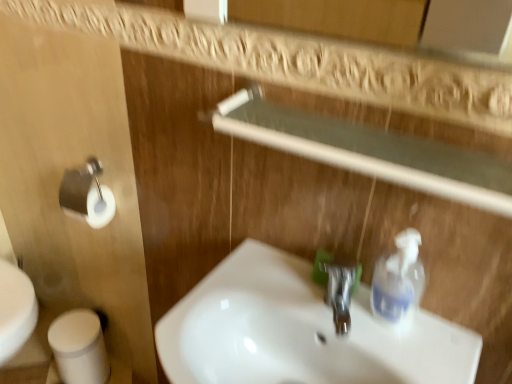
Describe the element at coordinates (300, 332) in the screenshot. I see `white glossy sink at center` at that location.

The width and height of the screenshot is (512, 384). What do you see at coordinates (398, 279) in the screenshot? I see `clear plastic soap dispenser at right` at bounding box center [398, 279].

Describe the element at coordinates (370, 151) in the screenshot. I see `transparent glass balustrade at upper center` at that location.

Where is `polished chrome faucet at center`? polished chrome faucet at center is located at coordinates (340, 292).

How different are the orientations of polished chrome faucet at center and white matte toilet paper at lower left in degrees?

88.8 degrees.

Is polished chrome faucet at center next to white matte toilet paper at lower left and touching it?

polished chrome faucet at center and white matte toilet paper at lower left are not in contact.

Which is behind, polished chrome faucet at center or white matte toilet paper at lower left?

white matte toilet paper at lower left is further from the camera.

Which is closer, (350, 284) or (84, 365)?

Clearly, point (350, 284) is closer to the camera than point (84, 365).

Is white matte toilet paper at lower left not near polished chrome faucet at center?

Yes, white matte toilet paper at lower left and polished chrome faucet at center are quite far apart.

Consider the image. Which of these two, white matte toilet paper at lower left or polished chrome faucet at center, stands shorter?

polished chrome faucet at center.

Is white matte toilet paper at lower left looking in the opposite direction of polished chrome faucet at center?

white matte toilet paper at lower left is not turned away from polished chrome faucet at center.

In the image, is transparent glass balustrade at upper center positioned in front of or behind clear plastic soap dispenser at right?

Clearly, transparent glass balustrade at upper center is in front of clear plastic soap dispenser at right.

From a real-world perspective, which is physically below, transparent glass balustrade at upper center or clear plastic soap dispenser at right?

clear plastic soap dispenser at right.

From the image's perspective, relative to clear plastic soap dispenser at right, is transparent glass balustrade at upper center above or below?

Based on their image positions, transparent glass balustrade at upper center is located above clear plastic soap dispenser at right.

Can you confirm if transparent glass balustrade at upper center is positioned to the left of white glossy sink at center?

No.

From a real-world perspective, which is physically above, transparent glass balustrade at upper center or white glossy sink at center?

transparent glass balustrade at upper center.

Which of these two, transparent glass balustrade at upper center or white glossy sink at center, is bigger?

white glossy sink at center is bigger.

Considering the relative positions of transparent glass balustrade at upper center and white glossy sink at center in the image provided, is transparent glass balustrade at upper center behind white glossy sink at center?

Yes, transparent glass balustrade at upper center is further from the camera.

Is point (338, 264) in front of point (250, 324)?

That is False.

Is polished chrome faucet at center at the right side of white glossy sink at center?

Correct, you'll find polished chrome faucet at center to the right of white glossy sink at center.

Is the surface of polished chrome faucet at center in direct contact with white glossy sink at center?

No, polished chrome faucet at center is not making contact with white glossy sink at center.

Who is more distant, white matte toilet paper at lower left or white glossy sink at center?

white matte toilet paper at lower left is further from the camera.

Considering the relative positions of white matte toilet paper at lower left and white glossy sink at center in the image provided, is white matte toilet paper at lower left to the right of white glossy sink at center from the viewer's perspective?

No, white matte toilet paper at lower left is not to the right of white glossy sink at center.

Is white matte toilet paper at lower left thinner than white glossy sink at center?

Indeed, white matte toilet paper at lower left has a lesser width compared to white glossy sink at center.

This screenshot has width=512, height=384. Find the location of `toilet paper below the white glossy sink at center (from the image's perspective)`. toilet paper below the white glossy sink at center (from the image's perspective) is located at coordinates [79, 347].

Between white glossy sink at center and polished chrome faucet at center, which one is positioned in front?

Positioned in front is white glossy sink at center.

Looking at this image, from a real-world perspective, is white glossy sink at center above or below polished chrome faucet at center?

white glossy sink at center is below polished chrome faucet at center.

Can you confirm if white glossy sink at center is taller than polished chrome faucet at center?

Yes, white glossy sink at center is taller than polished chrome faucet at center.

Is there a large distance between white glossy sink at center and polished chrome faucet at center?

They are positioned close to each other.

The height and width of the screenshot is (384, 512). I want to click on tap located above the white matte toilet paper at lower left (from a real-world perspective), so click(340, 292).

In order to click on toilet paper on the left of polished chrome faucet at center in this screenshot , I will do `click(79, 347)`.

Which object lies nearer to the anchor point transparent glass balustrade at upper center, clear plastic soap dispenser at right or polished chrome faucet at center?

Based on the image, clear plastic soap dispenser at right appears to be nearer to transparent glass balustrade at upper center.

Based on their spatial positions, is transparent glass balustrade at upper center or white glossy sink at center closer to polished chrome faucet at center?

white glossy sink at center is closer to polished chrome faucet at center.

Looking at the image, which one is located further to white matte toilet paper at lower left, white glossy sink at center or clear plastic soap dispenser at right?

clear plastic soap dispenser at right is further to white matte toilet paper at lower left.

Estimate the real-world distances between objects in this image. Which object is closer to transparent glass balustrade at upper center, clear plastic soap dispenser at right or white matte toilet paper at lower left?

Based on the image, clear plastic soap dispenser at right appears to be nearer to transparent glass balustrade at upper center.

Which object lies nearer to the anchor point clear plastic soap dispenser at right, white matte toilet paper at lower left or polished chrome faucet at center?

polished chrome faucet at center.

Based on the photo, when comparing their distances from transparent glass balustrade at upper center, does white glossy sink at center or clear plastic soap dispenser at right seem closer?

Based on the image, clear plastic soap dispenser at right appears to be nearer to transparent glass balustrade at upper center.

Looking at the image, which one is located further to white matte toilet paper at lower left, transparent glass balustrade at upper center or white glossy sink at center?

transparent glass balustrade at upper center lies further to white matte toilet paper at lower left than the other object.

Looking at the image, which one is located closer to polished chrome faucet at center, white matte toilet paper at lower left or white glossy sink at center?

white glossy sink at center is closer to polished chrome faucet at center.

This screenshot has width=512, height=384. Identify the location of cleaning product between white glossy sink at center and polished chrome faucet at center in the front-back direction. (398, 279).

You are a GUI agent. You are given a task and a screenshot of the screen. Output one action in this format:
    pyautogui.click(x=<x>, y=<y>)
    Task: Click on the balustrade between white matte toilet paper at lower left and polished chrome faucet at center
    This screenshot has height=384, width=512.
    Given the screenshot: What is the action you would take?
    pyautogui.click(x=370, y=151)

Locate an element on the screen. This screenshot has height=384, width=512. tap located between white matte toilet paper at lower left and clear plastic soap dispenser at right in the left-right direction is located at coordinates (340, 292).

Where is `balustrade positioned between white glossy sink at center and white matte toilet paper at lower left from near to far`? balustrade positioned between white glossy sink at center and white matte toilet paper at lower left from near to far is located at coordinates (370, 151).